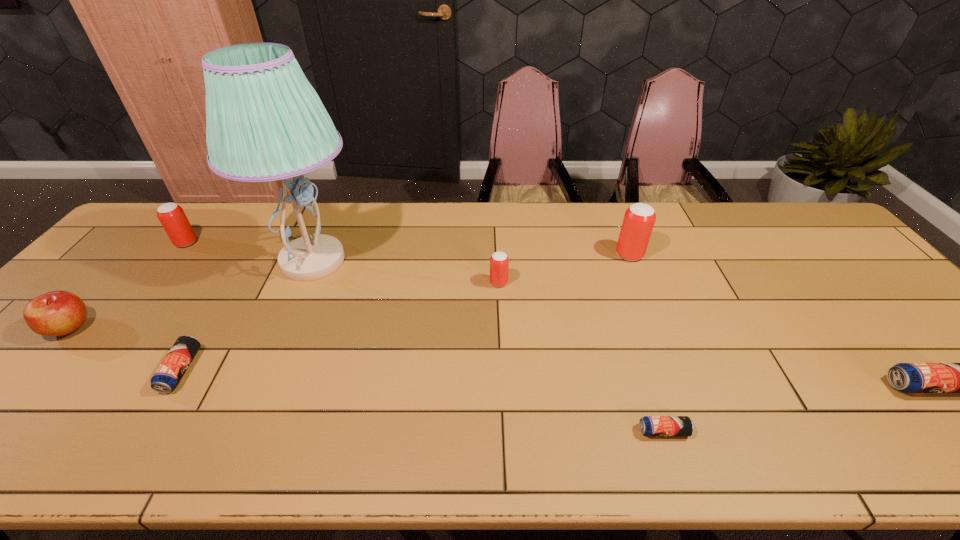
Where is `the fifth object from right to left`? The height and width of the screenshot is (540, 960). the fifth object from right to left is located at coordinates (265, 122).

Locate an element on the screen. The height and width of the screenshot is (540, 960). lamp is located at coordinates [265, 122].

At what (x,y) coordinates should I click in order to perform the action: click on the second tallest object. Please return your answer as a coordinate pair (x, y). This screenshot has width=960, height=540. Looking at the image, I should click on (639, 219).

The image size is (960, 540). I want to click on the tallest beer can, so click(639, 219).

The image size is (960, 540). Find the location of `the second tallest beer can`. the second tallest beer can is located at coordinates (172, 217).

The width and height of the screenshot is (960, 540). In order to click on the second object from left to right in this screenshot , I will do `click(172, 217)`.

Identify the location of the leftmost object. The image size is (960, 540). (57, 313).

Identify the location of the fourth nearest object. The height and width of the screenshot is (540, 960). (57, 313).

Identify the location of the third beer can from left to right. The height and width of the screenshot is (540, 960). (499, 262).

Locate an element on the screen. This screenshot has width=960, height=540. the smallest red beer can is located at coordinates (499, 262).